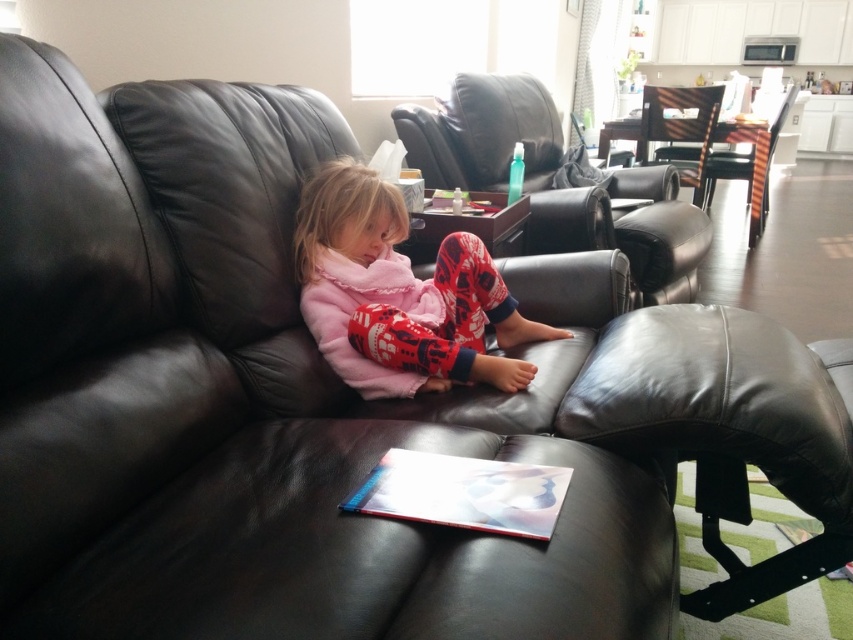
Question: Where is black leather ottoman at lower right located in relation to matte plastic book at center in the image?

Choices:
 (A) right
 (B) left

Answer: (A)

Question: Which point is closer to the camera?

Choices:
 (A) matte plastic book at center
 (B) pink fleece pajamas at center
 (C) wooden chair at center
 (D) striped wood chair at center

Answer: (A)

Question: Estimate the real-world distances between objects in this image. Which object is farther from the black leather ottoman at lower right?

Choices:
 (A) wooden chair at center
 (B) matte plastic book at center
 (C) striped wood chair at center
 (D) pink fleece pajamas at center

Answer: (C)

Question: Can you confirm if matte black armchair at center is bigger than striped wood chair at center?

Choices:
 (A) yes
 (B) no

Answer: (B)

Question: Is pink fleece pajamas at center in front of striped wood chair at center?

Choices:
 (A) yes
 (B) no

Answer: (A)

Question: Which of the following is the closest to the observer?

Choices:
 (A) matte black armchair at center
 (B) striped wood chair at center

Answer: (A)